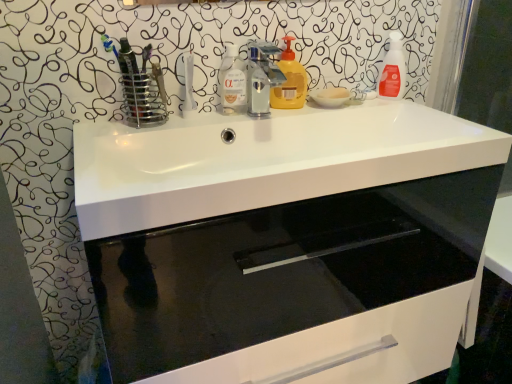
At what (x,y) coordinates should I click in order to perform the action: click on free space that is to the left of transparent liquid at center, the third cleaning product when ordered from right to left. Please return your answer as a coordinate pair (x, y). This screenshot has height=384, width=512. Looking at the image, I should click on (164, 120).